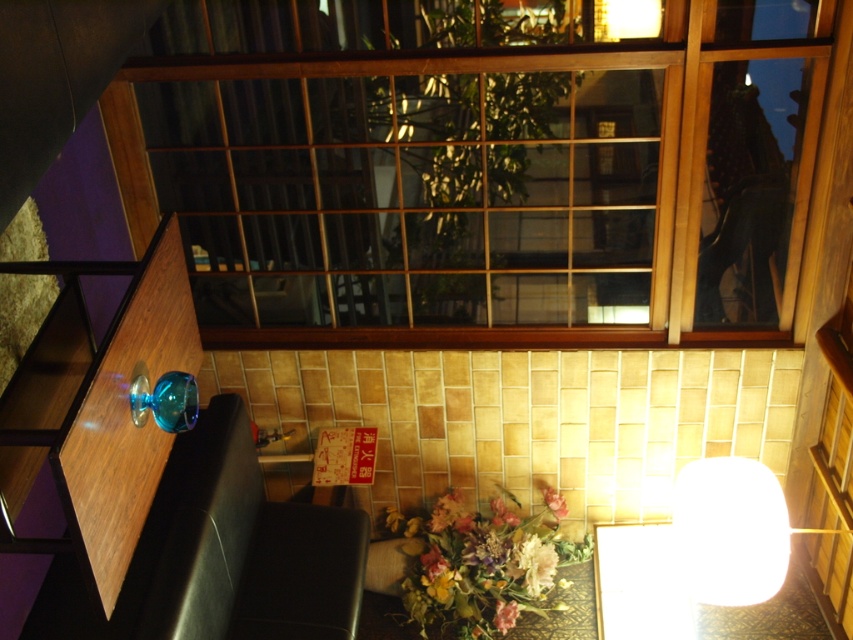
Question: Which of the following is the farthest from the observer?

Choices:
 (A) (624, 198)
 (B) (556, 499)

Answer: (B)

Question: Estimate the real-world distances between objects in this image. Which object is closer to the pastel floral bouquet at center?

Choices:
 (A) pink fabric flower at lower center
 (B) pastel floral arrangement at lower center
 (C) white glossy lampshade at lower right

Answer: (B)

Question: Which point appears closest to the camera in this image?

Choices:
 (A) (538, 586)
 (B) (498, 608)
 (C) (434, 531)
 (D) (531, 548)

Answer: (B)

Question: Can you confirm if wooden frame at upper center is bigger than pink fabric flower at lower center?

Choices:
 (A) no
 (B) yes

Answer: (B)

Question: Is pastel pink silk flower at lower center closer to camera compared to pastel floral arrangement at lower center?

Choices:
 (A) yes
 (B) no

Answer: (A)

Question: Is transparent glass lamp at lower left thinner than pastel floral arrangement at lower center?

Choices:
 (A) no
 (B) yes

Answer: (B)